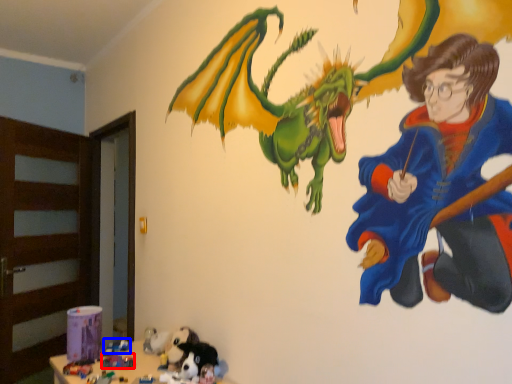
Question: Which object is closer to the camera taking this photo, toy (highlighted by a red box) or toy (highlighted by a blue box)?

Choices:
 (A) toy
 (B) toy

Answer: (A)